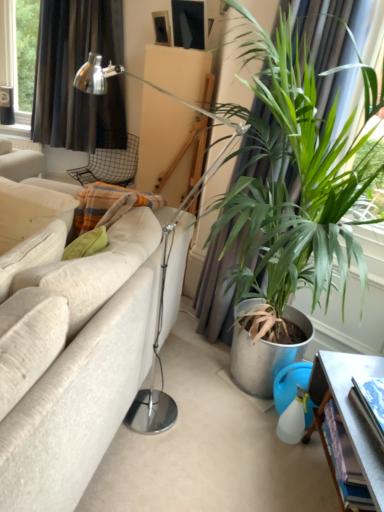
This screenshot has height=512, width=384. What do you see at coordinates (188, 24) in the screenshot?
I see `matte black picture frame at upper center` at bounding box center [188, 24].

The height and width of the screenshot is (512, 384). I want to click on green leafy plant at right, so click(291, 192).

This screenshot has width=384, height=512. What do you see at coordinates (74, 76) in the screenshot? I see `black fabric curtain at upper left` at bounding box center [74, 76].

I want to click on matte black picture frame at upper center, so click(x=188, y=24).

Would you consider metal mesh chair at upper center to be distant from metallic gray table at lower right?

Yes, metal mesh chair at upper center is far from metallic gray table at lower right.

Who is taller, metal mesh chair at upper center or metallic gray table at lower right?

Standing taller between the two is metallic gray table at lower right.

Can you confirm if metal mesh chair at upper center is wider than metallic gray table at lower right?

Indeed, metal mesh chair at upper center has a greater width compared to metallic gray table at lower right.

In the scene shown: Considering the positions of objects metal mesh chair at upper center and metallic gray table at lower right in the image provided, who is more to the right, metal mesh chair at upper center or metallic gray table at lower right?

Positioned to the right is metallic gray table at lower right.

Which of these two, white fabric couch at left or metal mesh chair at upper center, stands taller?

white fabric couch at left.

Which is more to the left, white fabric couch at left or metal mesh chair at upper center?

From the viewer's perspective, white fabric couch at left appears more on the left side.

Based on the photo, would you consider white fabric couch at left to be distant from metal mesh chair at upper center?

Indeed, white fabric couch at left is not near metal mesh chair at upper center.

Considering the relative sizes of metallic gray table at lower right and white fabric couch at left in the image provided, is metallic gray table at lower right taller than white fabric couch at left?

No, metallic gray table at lower right is not taller than white fabric couch at left.

Which object is closer to the camera taking this photo, metallic gray table at lower right or white fabric couch at left?

white fabric couch at left is more forward.

I want to click on studio couch in front of the metallic gray table at lower right, so click(72, 355).

How many degrees apart are the facing directions of metallic gray table at lower right and white fabric couch at left?

The angle between the facing direction of metallic gray table at lower right and the facing direction of white fabric couch at left is 13 degrees.

Is point (194, 6) positioned in front of point (53, 508)?

No, it is not.

Is matte black picture frame at upper center thinner than white fabric couch at left?

Yes.

Consider the image. Considering the relative positions of matte black picture frame at upper center and white fabric couch at left in the image provided, is matte black picture frame at upper center to the left or to the right of white fabric couch at left?

From the image, it's evident that matte black picture frame at upper center is to the right of white fabric couch at left.

Is matte black picture frame at upper center located outside white fabric couch at left?

matte black picture frame at upper center lies outside white fabric couch at left's area.

Is black fabric curtain at upper left taller than matte black picture frame at upper center?

Correct, black fabric curtain at upper left is much taller as matte black picture frame at upper center.

Between black fabric curtain at upper left and matte black picture frame at upper center, which one has larger width?

black fabric curtain at upper left.

Would you say matte black picture frame at upper center is part of black fabric curtain at upper left's contents?

No, matte black picture frame at upper center is not surrounded by black fabric curtain at upper left.

Is black fabric curtain at upper left oriented towards matte black picture frame at upper center?

No, black fabric curtain at upper left is not oriented towards matte black picture frame at upper center.

In terms of size, does metal mesh chair at upper center appear bigger or smaller than black fabric curtain at upper left?

Clearly, metal mesh chair at upper center is smaller in size than black fabric curtain at upper left.

How far apart are metal mesh chair at upper center and black fabric curtain at upper left?

metal mesh chair at upper center and black fabric curtain at upper left are 16.63 inches apart from each other.

Is metal mesh chair at upper center inside or outside of black fabric curtain at upper left?

The correct answer is: outside.

From a real-world perspective, does metal mesh chair at upper center stand above black fabric curtain at upper left?

No.

I want to click on houseplant beneath the matte black picture frame at upper center (from a real-world perspective), so click(x=291, y=192).

Which object is more forward, matte black picture frame at upper center or green leafy plant at right?

green leafy plant at right is closer to the camera.

Between point (178, 37) and point (351, 320), which one is positioned behind?

The point (178, 37) is farther from the camera.

Considering the relative sizes of matte black picture frame at upper center and green leafy plant at right in the image provided, is matte black picture frame at upper center bigger than green leafy plant at right?

No.

Find the location of `chair behind the metallic gray table at lower right`. chair behind the metallic gray table at lower right is located at coordinates (110, 165).

Where is `chair above the white fabric couch at left (from the image's perspective)`? chair above the white fabric couch at left (from the image's perspective) is located at coordinates (110, 165).

Based on their spatial positions, is matte black picture frame at upper center or white fabric couch at left closer to metallic gray table at lower right?

white fabric couch at left lies closer to metallic gray table at lower right than the other object.

When comparing their distances from black fabric curtain at upper left, does matte black picture frame at upper center or metal mesh chair at upper center seem closer?

metal mesh chair at upper center is positioned closer to the anchor black fabric curtain at upper left.

Based on the photo, looking at the image, which one is located closer to metal mesh chair at upper center, metallic gray table at lower right or black fabric curtain at upper left?

black fabric curtain at upper left lies closer to metal mesh chair at upper center than the other object.

Looking at the image, which one is located further to white fabric couch at left, metal mesh chair at upper center or green leafy plant at right?

metal mesh chair at upper center.

Based on their spatial positions, is white fabric couch at left or metallic gray table at lower right closer to metal mesh chair at upper center?

Among the two, white fabric couch at left is located nearer to metal mesh chair at upper center.

Considering their positions, is white fabric couch at left positioned closer to green leafy plant at right than metallic gray table at lower right?

white fabric couch at left lies closer to green leafy plant at right than the other object.

Estimate the real-world distances between objects in this image. Which object is closer to matte black picture frame at upper center, black fabric curtain at upper left or metallic gray table at lower right?

Based on the image, black fabric curtain at upper left appears to be nearer to matte black picture frame at upper center.

Based on the photo, based on their spatial positions, is metallic gray table at lower right or white fabric couch at left further from green leafy plant at right?

metallic gray table at lower right is further to green leafy plant at right.

The image size is (384, 512). I want to click on picture frame located between green leafy plant at right and metal mesh chair at upper center in the depth direction, so click(x=188, y=24).

Identify the location of curtain between matte black picture frame at upper center and metallic gray table at lower right from top to bottom. This screenshot has width=384, height=512. [x=74, y=76].

This screenshot has width=384, height=512. What are the coordinates of `houseplant located between white fabric couch at left and metallic gray table at lower right in the left-right direction` in the screenshot? It's located at (291, 192).

This screenshot has width=384, height=512. I want to click on studio couch between matte black picture frame at upper center and metallic gray table at lower right from top to bottom, so click(72, 355).